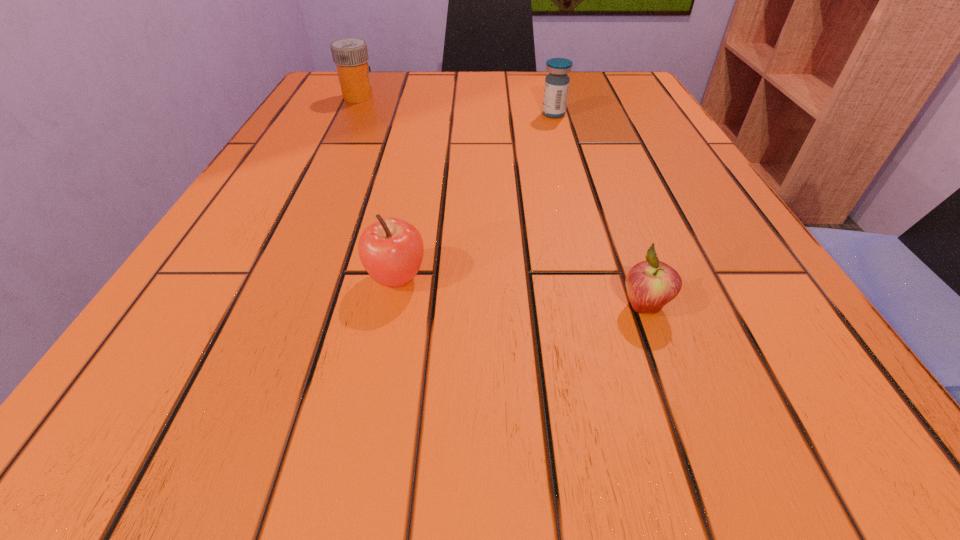
Where is `object that is positioned at the left edge`? object that is positioned at the left edge is located at coordinates tap(350, 55).

The width and height of the screenshot is (960, 540). Find the location of `object present at the right edge`. object present at the right edge is located at coordinates (651, 284).

You are a GUI agent. You are given a task and a screenshot of the screen. Output one action in this format:
    pyautogui.click(x=<x>, y=<y>)
    Task: Click on the object located at the far left corner
    
    Given the screenshot: What is the action you would take?
    pyautogui.click(x=350, y=55)

Locate an element on the screen. The image size is (960, 540). blank area at the far edge is located at coordinates (450, 96).

Where is `vacant space at the near edge of the desktop`? The height and width of the screenshot is (540, 960). vacant space at the near edge of the desktop is located at coordinates (653, 405).

The width and height of the screenshot is (960, 540). I want to click on vacant region at the left edge of the desktop, so click(276, 234).

I want to click on free space at the right edge of the desktop, so click(728, 259).

In the image, there is a desktop. Where is `vacant space at the far left corner`? This screenshot has width=960, height=540. vacant space at the far left corner is located at coordinates 307,105.

This screenshot has width=960, height=540. Find the location of `vacant region at the far right corner`. vacant region at the far right corner is located at coordinates (607, 84).

This screenshot has width=960, height=540. What are the coordinates of `vacant space at the near right corner` in the screenshot? It's located at (811, 415).